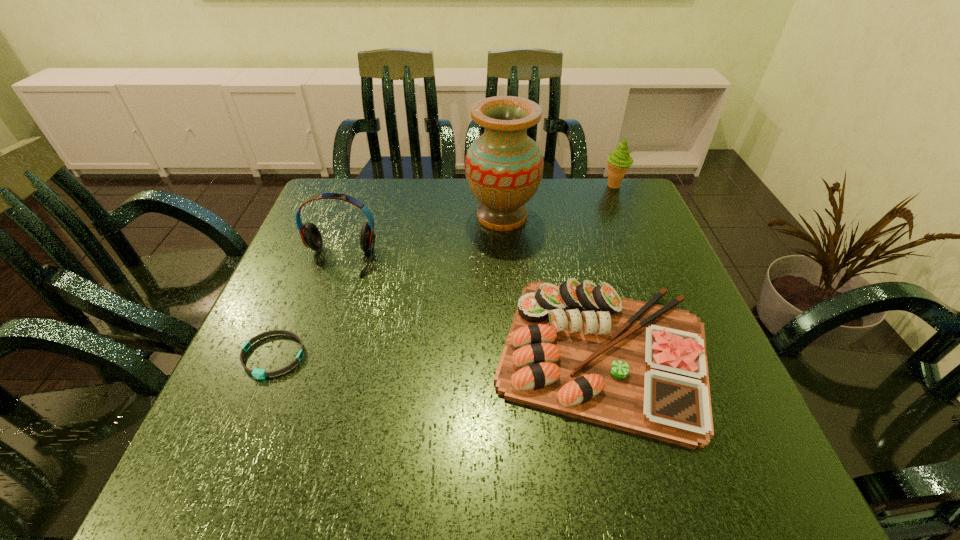
Locate an element on the screen. vase is located at coordinates (503, 167).

Locate an element on the screen. the second farthest object is located at coordinates (503, 167).

Locate an element on the screen. This screenshot has width=960, height=540. headset is located at coordinates (311, 237).

I want to click on icecream, so click(x=618, y=161).

Where is `platter`? The image size is (960, 540). platter is located at coordinates (577, 349).

This screenshot has height=540, width=960. I want to click on the shortest object, so click(x=256, y=373).

This screenshot has width=960, height=540. What are the coordinates of `vacant space positioned on the front of the tallest object` in the screenshot? It's located at (506, 274).

Image resolution: width=960 pixels, height=540 pixels. Identify the location of free space located 0.300m with the microphone attached to the side of the third nearest object. (292, 393).

Locate an element on the screen. free space located on the left of the icecream is located at coordinates (547, 186).

You are a GUI agent. You are given a task and a screenshot of the screen. Output one action in this format:
    pyautogui.click(x=<x>, y=<y>)
    Task: Click on the vacant region located on the back of the second shortest object
    This screenshot has width=960, height=540.
    Given the screenshot: What is the action you would take?
    pyautogui.click(x=565, y=205)